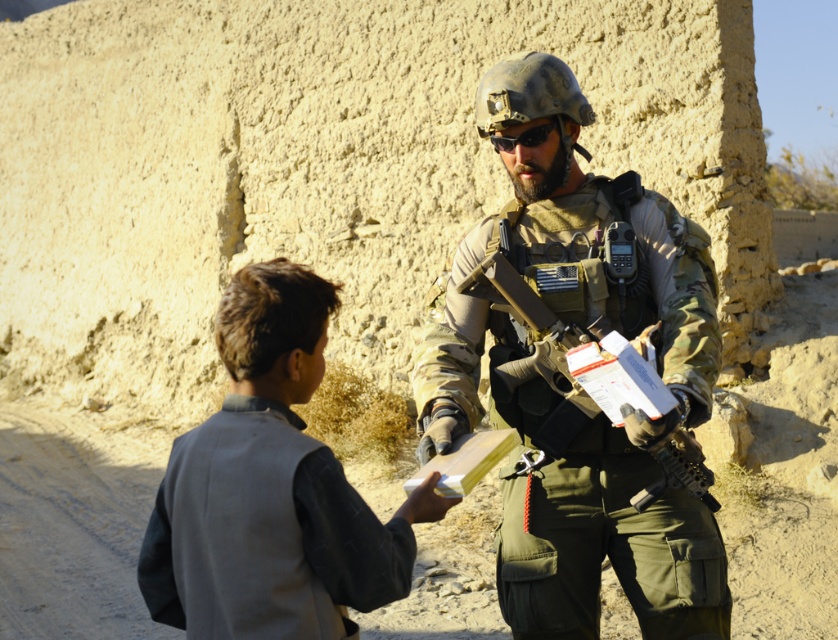
Describe the element at coordinates (272, 488) in the screenshot. The width and height of the screenshot is (838, 640). I see `light gray fabric shirt at lower left` at that location.

Between light gray fabric shirt at lower left and camouflage fabric rifle at center, which one appears on the right side from the viewer's perspective?

From the viewer's perspective, camouflage fabric rifle at center appears more on the right side.

Identify the location of light gray fabric shirt at lower left. (272, 488).

Locate an element on the screen. The height and width of the screenshot is (640, 838). light gray fabric shirt at lower left is located at coordinates (272, 488).

Who is shorter, camouflage fabric rifle at center or matte black goggles at center?

Standing shorter between the two is matte black goggles at center.

Can you confirm if camouflage fabric rifle at center is wider than matte black goggles at center?

Yes.

In order to click on camouflage fabric rifle at center in this screenshot , I will do `click(577, 348)`.

Is light gray fabric shirt at lower left smaller than matte black goggles at center?

Incorrect, light gray fabric shirt at lower left is not smaller in size than matte black goggles at center.

The width and height of the screenshot is (838, 640). Find the location of `light gray fabric shirt at lower left`. light gray fabric shirt at lower left is located at coordinates (272, 488).

Image resolution: width=838 pixels, height=640 pixels. Identify the location of light gray fabric shirt at lower left. (272, 488).